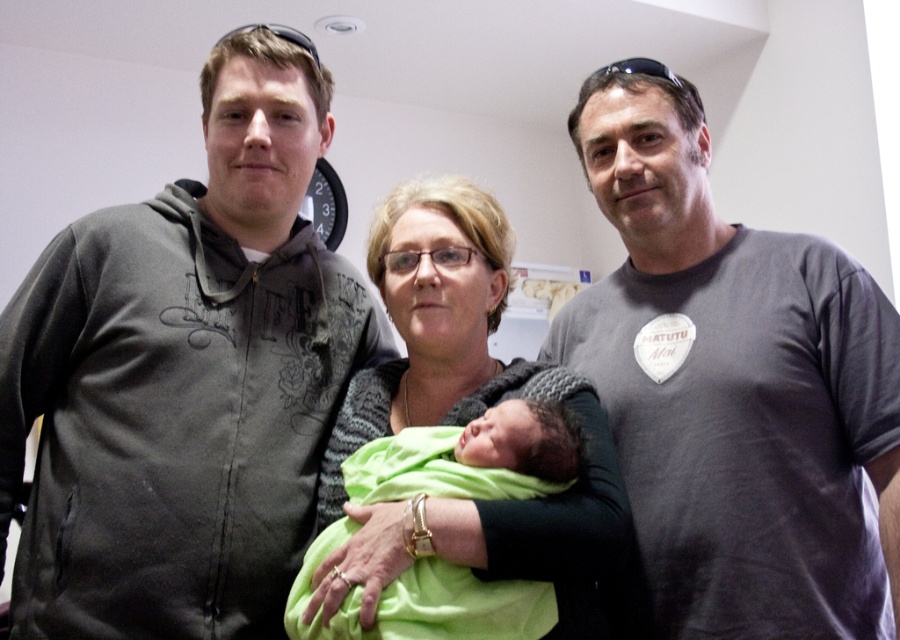
Question: Can you confirm if dark gray hoodie at left is positioned above green soft swaddle at center?

Choices:
 (A) no
 (B) yes

Answer: (B)

Question: Which object appears farthest from the camera in this image?

Choices:
 (A) green soft swaddle at center
 (B) dark gray hoodie at left

Answer: (B)

Question: Which point is closer to the camera taking this photo?

Choices:
 (A) (531, 392)
 (B) (245, 602)

Answer: (B)

Question: From the image, what is the correct spatial relationship of knitted sweater at center in relation to green soft swaddle at center?

Choices:
 (A) left
 (B) right

Answer: (A)

Question: Among these points, which one is nearest to the camera?

Choices:
 (A) (520, 448)
 (B) (432, 368)
 (C) (34, 512)

Answer: (A)

Question: Is dark gray hoodie at left closer to camera compared to knitted sweater at center?

Choices:
 (A) yes
 (B) no

Answer: (B)